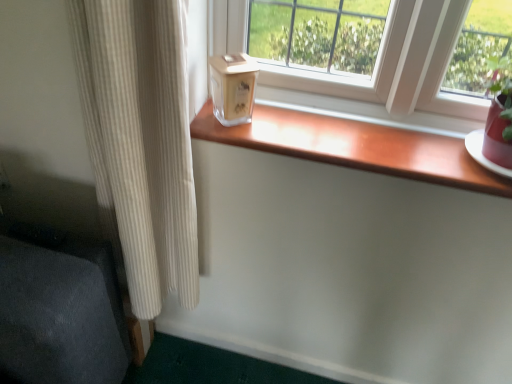
Identify the location of wooden at center. (355, 146).

Identify the location of beige ribbed curtain at left. This screenshot has width=512, height=384. (141, 140).

Does wooden at center appear on the right side of beige ribbed curtain at left?

Yes, wooden at center is to the right of beige ribbed curtain at left.

Is wooden at center positioned far away from beige ribbed curtain at left?

No, wooden at center is not far from beige ribbed curtain at left.

Is wooden at center surrounding beige ribbed curtain at left?

No.

From a real-world perspective, is beige ribbed curtain at left physically below wooden at center?

Yes, from a real-world perspective, beige ribbed curtain at left is beneath wooden at center.

Is beige ribbed curtain at left facing away from wooden at center?

That's not correct — beige ribbed curtain at left is not looking away from wooden at center.

Who is smaller, beige ribbed curtain at left or wooden at center?

wooden at center is smaller.

Based on the photo, who is bigger, clear glass candle at center or beige ribbed curtain at left?

beige ribbed curtain at left.

Does clear glass candle at center have a lesser height compared to beige ribbed curtain at left?

Yes, clear glass candle at center is shorter than beige ribbed curtain at left.

Which object is more forward, clear glass candle at center or beige ribbed curtain at left?

beige ribbed curtain at left is more forward.

Is beige ribbed curtain at left further to camera compared to clear glass candle at center?

No, beige ribbed curtain at left is closer to the viewer.

Is beige ribbed curtain at left wider than clear glass candle at center?

Yes.

Is clear glass candle at center touching wooden at center?

clear glass candle at center is not next to wooden at center, and they're not touching.

The image size is (512, 384). I want to click on window box on the left of wooden at center, so click(x=232, y=87).

Is clear glass candle at center oriented towards wooden at center?

No, clear glass candle at center is not aimed at wooden at center.

Relative to wooden at center, is clear glass candle at center in front or behind?

clear glass candle at center is behind wooden at center.

Who is bigger, wooden at center or clear glass candle at center?

wooden at center is bigger.

Can you confirm if wooden at center is positioned to the left of clear glass candle at center?

Incorrect, wooden at center is not on the left side of clear glass candle at center.

In order to click on window box behind the wooden at center in this screenshot , I will do `click(232, 87)`.

How distant is wooden at center from clear glass candle at center?

wooden at center is 8.16 inches from clear glass candle at center.

Locate an element on the screen. The image size is (512, 384). window sill behind the beige ribbed curtain at left is located at coordinates (355, 146).

Where is `curtain below the wooden at center (from the image's perspective)`? Image resolution: width=512 pixels, height=384 pixels. curtain below the wooden at center (from the image's perspective) is located at coordinates (141, 140).

Which object lies further to the anchor point wooden at center, beige ribbed curtain at left or clear glass candle at center?

beige ribbed curtain at left is further to wooden at center.

Which object lies further to the anchor point wooden at center, clear glass candle at center or beige ribbed curtain at left?

Among the two, beige ribbed curtain at left is located further to wooden at center.

Estimate the real-world distances between objects in this image. Which object is closer to clear glass candle at center, beige ribbed curtain at left or wooden at center?

The object closer to clear glass candle at center is wooden at center.

When comparing their distances from beige ribbed curtain at left, does wooden at center or clear glass candle at center seem closer?

Based on the image, clear glass candle at center appears to be nearer to beige ribbed curtain at left.

Based on their spatial positions, is clear glass candle at center or wooden at center closer to beige ribbed curtain at left?

Among the two, clear glass candle at center is located nearer to beige ribbed curtain at left.

Which object lies nearer to the anchor point clear glass candle at center, wooden at center or beige ribbed curtain at left?

wooden at center is closer to clear glass candle at center.

At what (x,y) coordinates should I click in order to perform the action: click on window box between beige ribbed curtain at left and wooden at center. Please return your answer as a coordinate pair (x, y). This screenshot has height=384, width=512. Looking at the image, I should click on tap(232, 87).